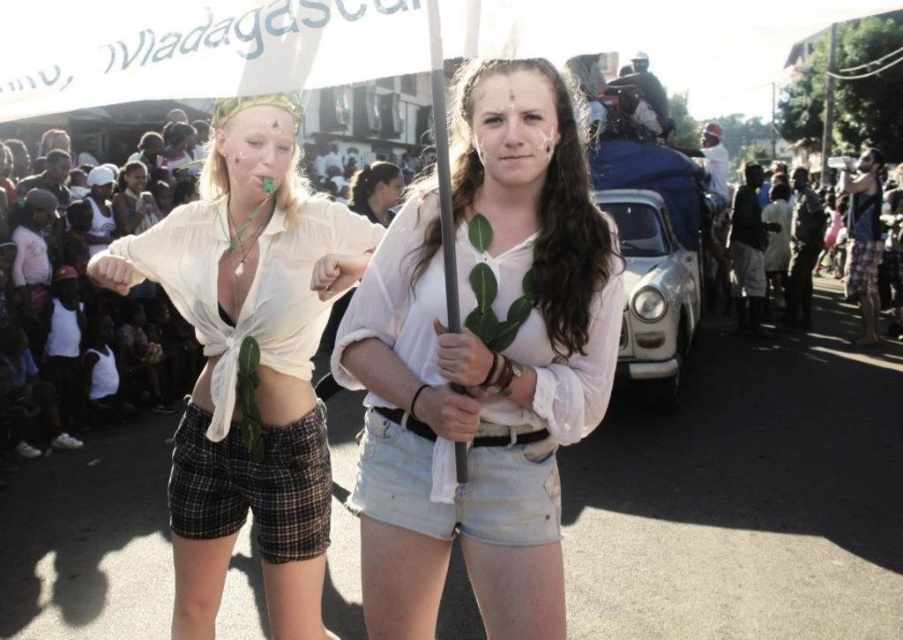
You are standing at the origin point in the street scene. There are two points marked in the image. The first point is at coordinates point (x=576, y=150) and the second point is at point (x=360, y=241). If you were to walk from the origin towards the first point, would you pass by the second point before reaching the first one?

Since point (x=576, y=150) is in front of point (x=360, y=241), walking towards the first point would mean you encounter it before the second point. Therefore, you would not pass the second point before reaching the first one.

You are a photographer positioned at the center of the street. You want to take a photo that includes both the white cotton shirt at center and the dark skin people at right. Given that your camera has a maximum focus range of 10 meters, will you be able to capture both subjects in focus?

The distance between the white cotton shirt at center and the dark skin people at right is 10.05 meters. Since the camera can only focus up to 10 meters, the subjects are slightly out of the focus range. Therefore, you won cannot capture both in focus.

You are a photographer trying to capture a photo of both the white cotton shirt at center and the dark skin people at right. Since you want to ensure both are in focus, which one should you focus on first to maximize clarity?

You should focus on the white cotton shirt at center first because it is closer to the viewer than the dark skin people at right. By focusing on the closer object, the depth of field may extend to include the farther object, ensuring both are in focus.